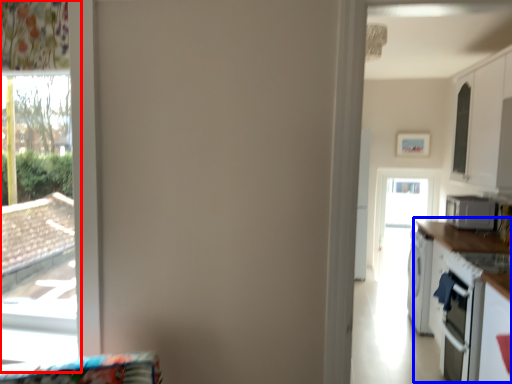
Question: Which point is closer to the camera, window (highlighted by a red box) or counter top (highlighted by a blue box)?

Choices:
 (A) window
 (B) counter top

Answer: (A)